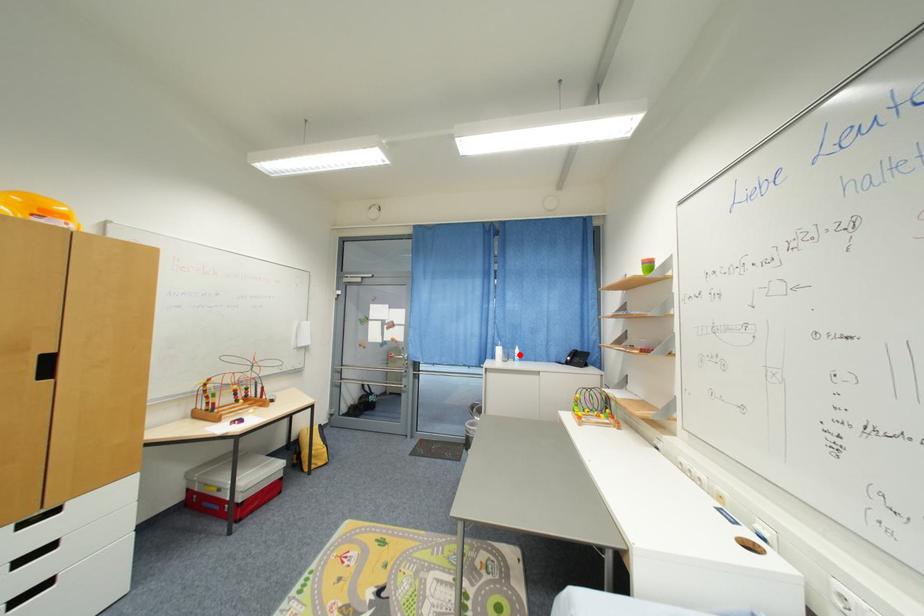
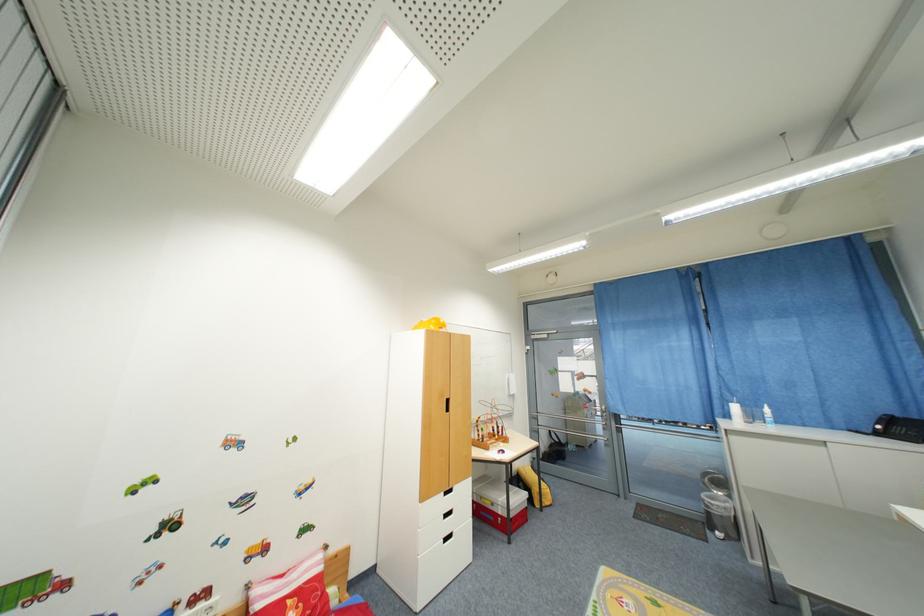
Find the pixel in the second image that matches the highlighted location in the first image.

(768, 415)